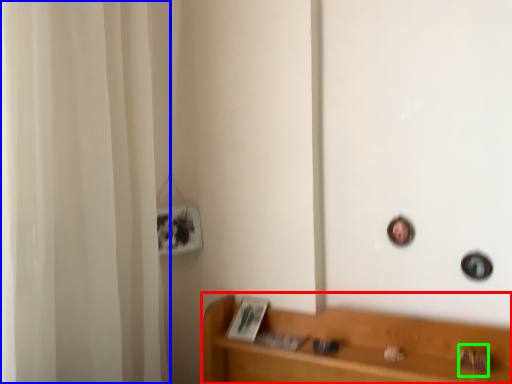
Question: Considering the real-world distances, which object is closest to furniture (highlighted by a red box)? shower curtain (highlighted by a blue box) or door handle (highlighted by a green box).

Choices:
 (A) shower curtain
 (B) door handle

Answer: (B)